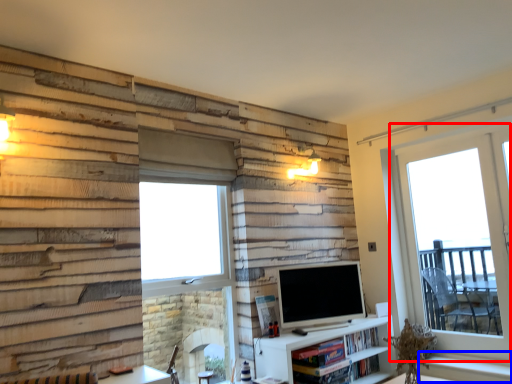
Question: Which of the following is the closest to the observer, window (highlighted by a red box) or window sill (highlighted by a blue box)?

Choices:
 (A) window
 (B) window sill

Answer: (B)